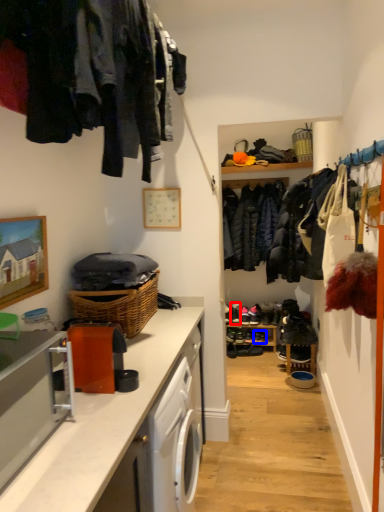
Question: Which of the following is the closest to the observer, shoe (highlighted by a red box) or shoe (highlighted by a blue box)?

Choices:
 (A) shoe
 (B) shoe

Answer: (B)